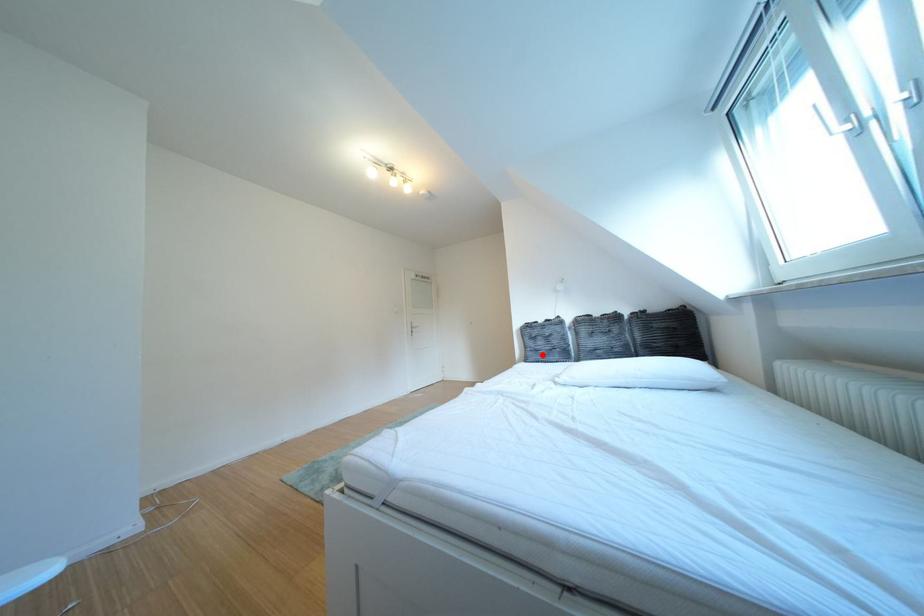
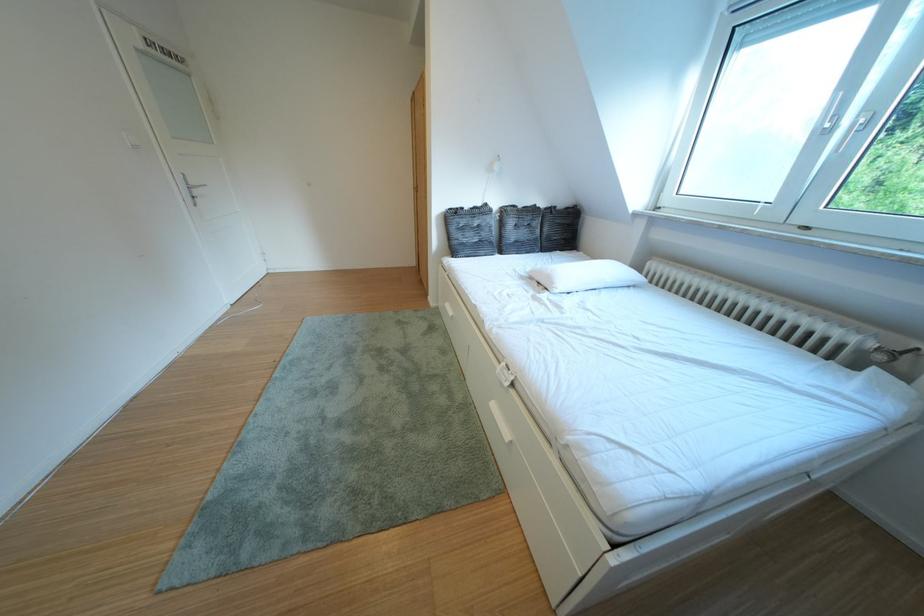
Question: I am providing you with two images of the same scene from different viewpoints. Image1 has a red point marked. In image2, the corresponding 3D location appears at what relative position? Reply with the corresponding letter.

Choices:
 (A) Closer
 (B) Farther

Answer: (A)